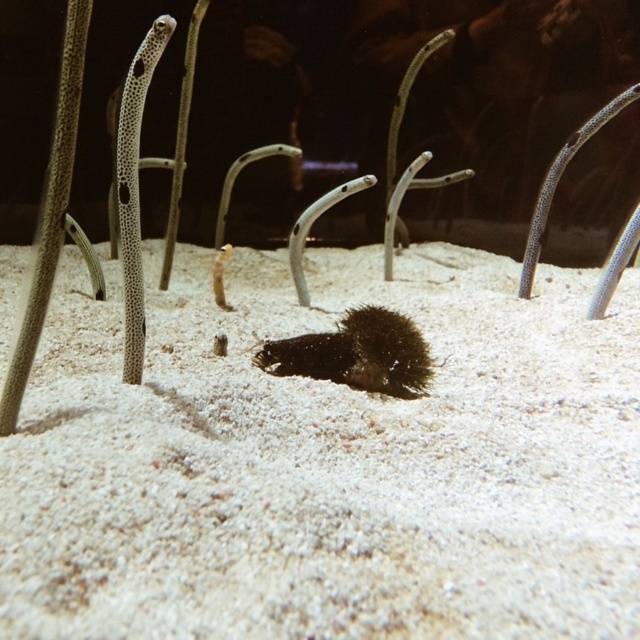
Question: Estimate the real-world distances between objects in this image. Which object is farther from the white sandy bottom at center?

Choices:
 (A) dark fuzzy sea urchin at center
 (B) speckled skin garden eel at left

Answer: (B)

Question: Estimate the real-world distances between objects in this image. Which object is closer to the speckled skin garden eel at left?

Choices:
 (A) white sandy bottom at center
 (B) dark fuzzy sea urchin at center

Answer: (B)

Question: Does white sandy bottom at center appear under dark fuzzy sea urchin at center?

Choices:
 (A) yes
 (B) no

Answer: (B)

Question: Can you confirm if dark fuzzy sea urchin at center is thinner than speckled skin garden eel at left?

Choices:
 (A) no
 (B) yes

Answer: (A)

Question: Which object appears farthest from the camera in this image?

Choices:
 (A) dark fuzzy sea urchin at center
 (B) white sandy bottom at center

Answer: (A)

Question: Can you confirm if dark fuzzy sea urchin at center is positioned to the left of speckled skin garden eel at left?

Choices:
 (A) yes
 (B) no

Answer: (B)